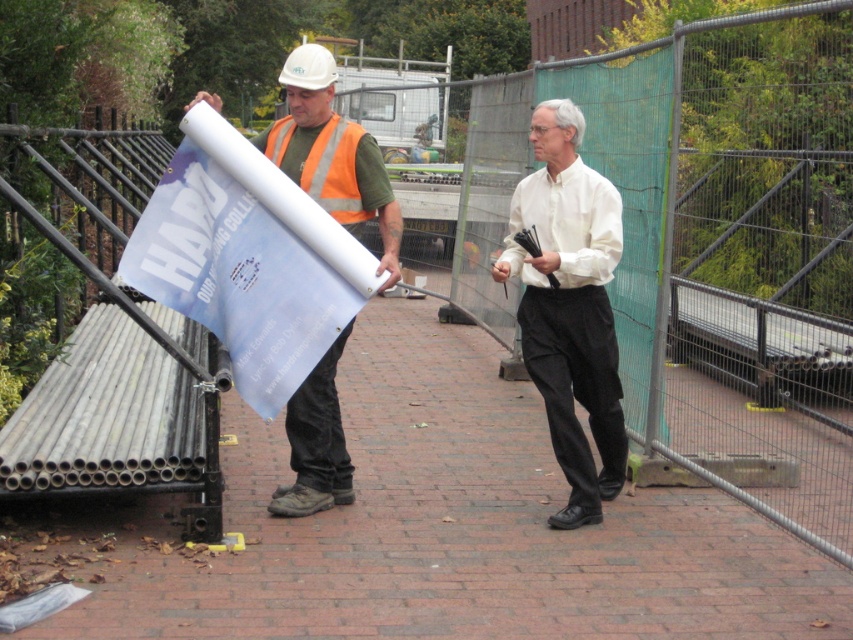
You are a construction worker who needs to check if your safety gear is properly positioned. According to the image, is the matte white hard hat at center closer to you than the orange reflective safety vest at center?

Yes, the matte white hard hat at center is in front of the orange reflective safety vest at center, so it is closer to you.

You are standing at the point with coordinates point (350, 134) and want to walk to the point with coordinates point (310, 500). Which direction should you move in relation to the other point?

You should move behind the point (350, 134) to reach the point (310, 500) because it is located behind it.